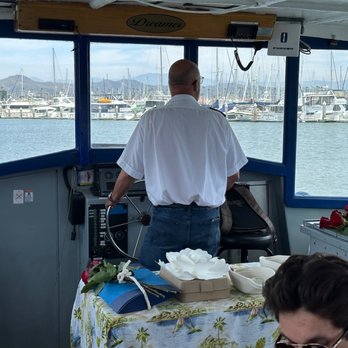
Identify the location of table cloth. The width and height of the screenshot is (348, 348). (225, 306).